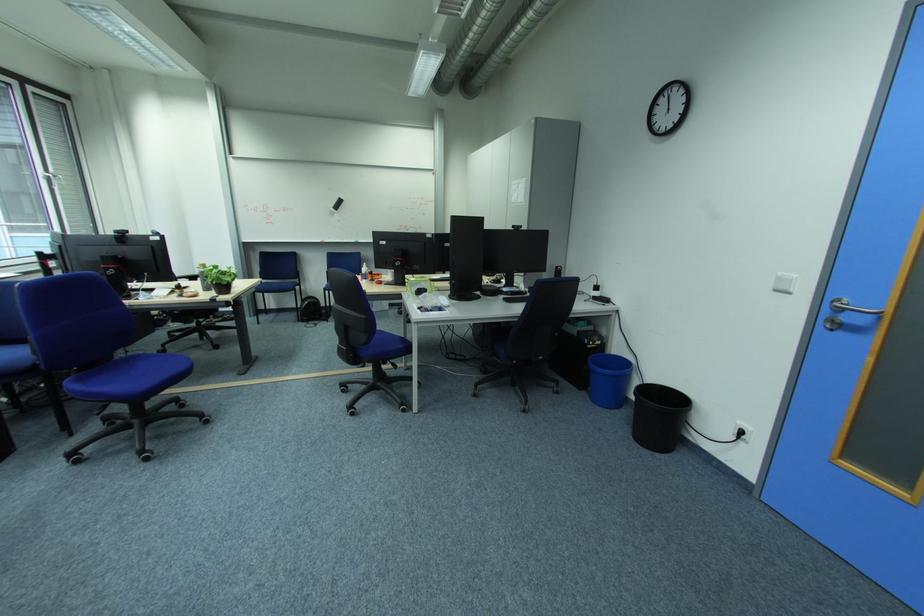
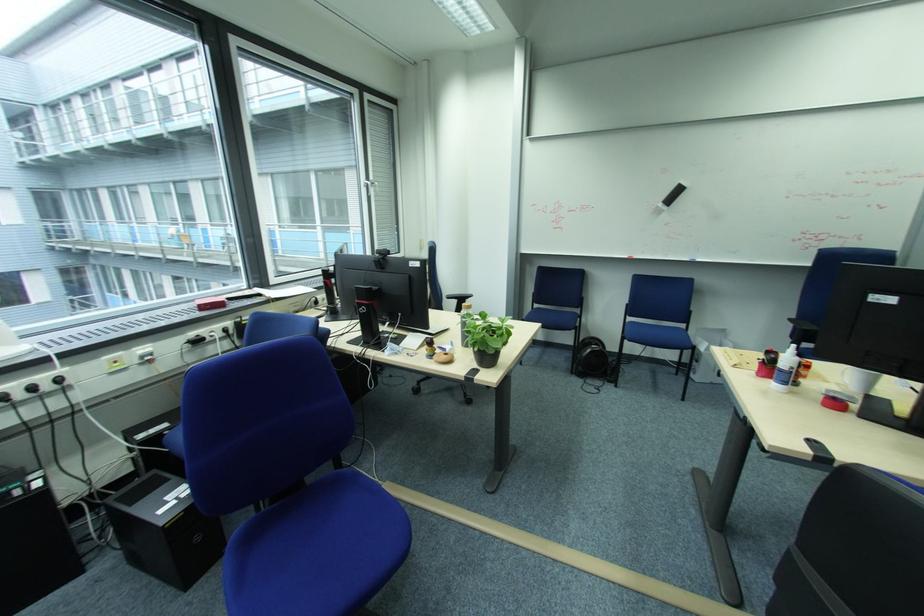
In the second image, find the point that corresponds to point (342, 209) in the first image.

(669, 206)